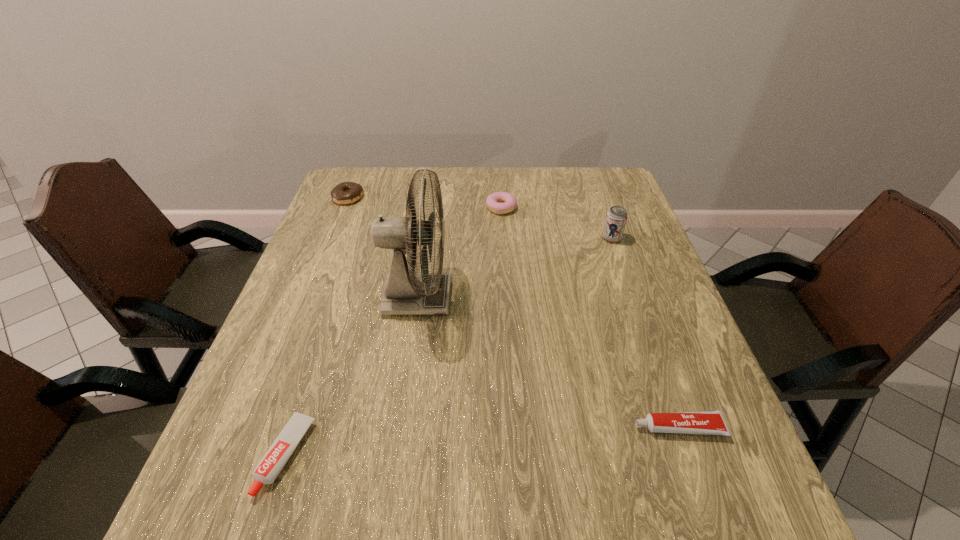
You are a GUI agent. You are given a task and a screenshot of the screen. Output one action in this format:
    pyautogui.click(x=<x>, y=<y>)
    Task: Click on the free space located 0.080m on the back of the fourth object from left to right
    The height and width of the screenshot is (540, 960).
    Given the screenshot: What is the action you would take?
    pyautogui.click(x=499, y=185)

Identify the location of vacant region located at the nozzle of the right toothpaste. (429, 427).

Locate an element on the screen. This screenshot has width=960, height=540. vacant area located 0.230m at the nozzle of the right toothpaste is located at coordinates (507, 427).

Locate an element on the screen. free location located 0.350m at the nozzle of the right toothpaste is located at coordinates (441, 427).

The height and width of the screenshot is (540, 960). I want to click on free space located on the front of the left toothpaste, so point(260,535).

Locate an element on the screen. This screenshot has width=960, height=540. object present at the near edge is located at coordinates (278, 454).

Locate an element on the screen. The width and height of the screenshot is (960, 540). doughnut located in the left edge section of the desktop is located at coordinates (346, 192).

Find the location of `toothpaste present at the left edge`. toothpaste present at the left edge is located at coordinates (278, 454).

Where is `beer can present at the right edge`? The image size is (960, 540). beer can present at the right edge is located at coordinates (616, 218).

Where is `toothpaste situated at the right edge`? The image size is (960, 540). toothpaste situated at the right edge is located at coordinates (x=703, y=422).